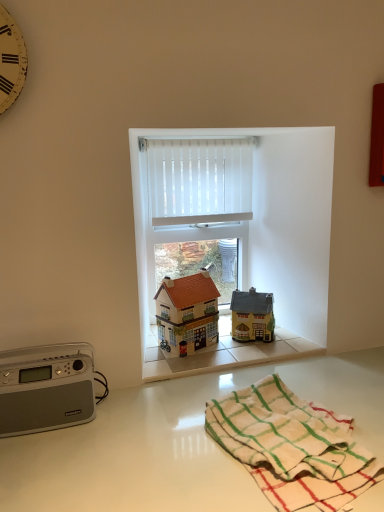
Question: Could matte brown house at center, the 2th toy from the right, be considered to be inside silver metallic radio at left?

Choices:
 (A) yes
 (B) no

Answer: (B)

Question: Considering the relative positions of silver metallic radio at left and matte brown house at center, the 2th toy from the right, in the image provided, is silver metallic radio at left to the right of matte brown house at center, the 2th toy from the right, from the viewer's perspective?

Choices:
 (A) no
 (B) yes

Answer: (A)

Question: Is silver metallic radio at left not within matte brown house at center, which ranks as the 1th toy in left-to-right order?

Choices:
 (A) yes
 (B) no

Answer: (A)

Question: From a real-world perspective, is silver metallic radio at left located beneath matte brown house at center, which ranks as the 1th toy in left-to-right order?

Choices:
 (A) no
 (B) yes

Answer: (B)

Question: Can you confirm if silver metallic radio at left is thinner than matte brown house at center, the 2th toy from the right?

Choices:
 (A) no
 (B) yes

Answer: (B)

Question: Is silver metallic radio at left taller than matte brown house at center, the 2th toy from the right?

Choices:
 (A) yes
 (B) no

Answer: (B)

Question: From the image's perspective, is yellow painted wood clock at upper left located beneath silver metallic radio at left?

Choices:
 (A) yes
 (B) no

Answer: (B)

Question: Considering the relative sizes of yellow painted wood clock at upper left and silver metallic radio at left in the image provided, is yellow painted wood clock at upper left taller than silver metallic radio at left?

Choices:
 (A) no
 (B) yes

Answer: (B)

Question: From the image's perspective, does yellow painted wood clock at upper left appear higher than silver metallic radio at left?

Choices:
 (A) no
 (B) yes

Answer: (B)

Question: Is yellow painted wood clock at upper left thinner than silver metallic radio at left?

Choices:
 (A) no
 (B) yes

Answer: (B)

Question: Can you confirm if yellow painted wood clock at upper left is smaller than silver metallic radio at left?

Choices:
 (A) no
 (B) yes

Answer: (B)

Question: Can we say yellow painted wood clock at upper left lies outside silver metallic radio at left?

Choices:
 (A) yes
 (B) no

Answer: (A)

Question: Considering the relative sizes of matte brown house at center, which ranks as the 1th toy in left-to-right order, and white vertical blinds at center in the image provided, is matte brown house at center, which ranks as the 1th toy in left-to-right order, thinner than white vertical blinds at center?

Choices:
 (A) yes
 (B) no

Answer: (B)